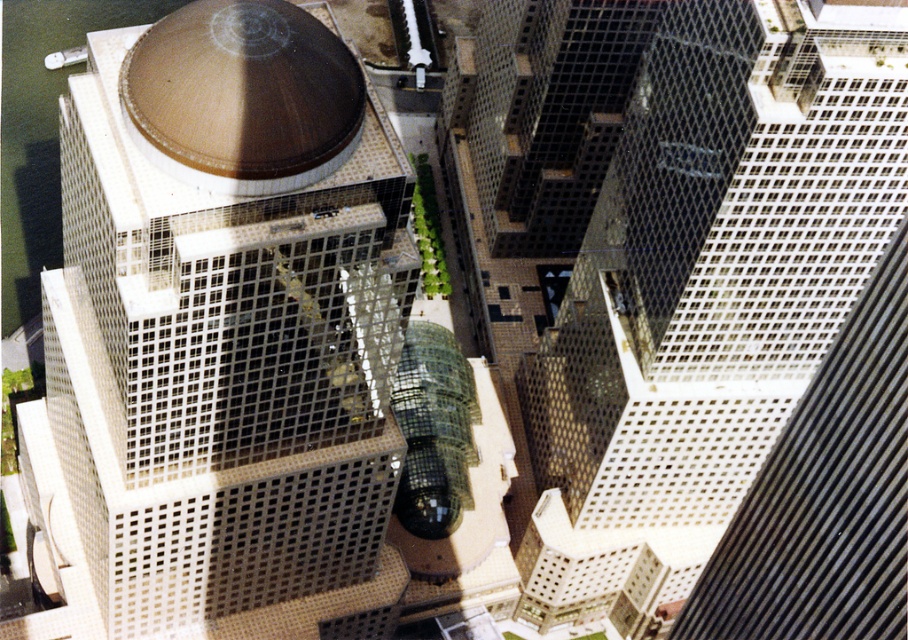
Question: Does white grid-patterned building at center-left appear on the left side of white grid-patterned building at center-right?

Choices:
 (A) yes
 (B) no

Answer: (A)

Question: Which point appears closest to the camera in this image?

Choices:
 (A) (262, 256)
 (B) (613, 406)

Answer: (A)

Question: Is white grid-patterned building at center-left below white grid-patterned building at center-right?

Choices:
 (A) no
 (B) yes

Answer: (B)

Question: Which of the following is the farthest from the observer?

Choices:
 (A) white grid-patterned building at center-right
 (B) white grid-patterned building at center-left

Answer: (A)

Question: Is white grid-patterned building at center-left behind white grid-patterned building at center-right?

Choices:
 (A) no
 (B) yes

Answer: (A)